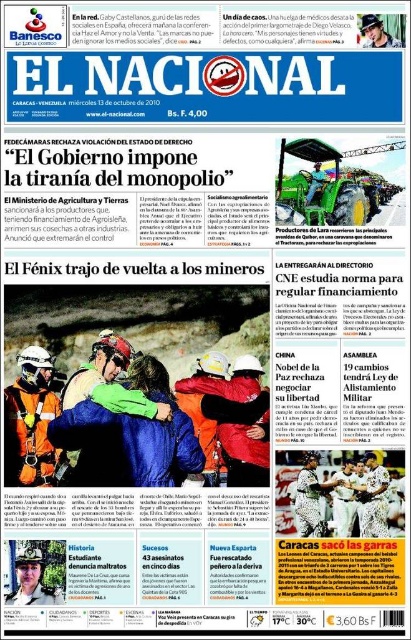
Question: Does orange reflective jacket at center come behind orange reflective safety vest at left?

Choices:
 (A) no
 (B) yes

Answer: (A)

Question: Can you confirm if camouflage fabric shirt at center is smaller than smooth leather cap at upper right?

Choices:
 (A) no
 (B) yes

Answer: (A)

Question: Is green rubber tractor at center wider than green fabric tractor at center?

Choices:
 (A) yes
 (B) no

Answer: (A)

Question: Which of the following is the closest to the observer?

Choices:
 (A) orange reflective safety vest at left
 (B) green fabric tractor at center
 (C) orange reflective jacket at center
 (D) matte black helmet at center

Answer: (D)

Question: Which object is closer to the camera taking this photo?

Choices:
 (A) matte black helmet at center
 (B) smooth leather cap at upper right

Answer: (A)

Question: Which point is farther to the camera?

Choices:
 (A) (364, 42)
 (B) (304, 202)
 (C) (23, 588)
 (D) (306, 513)

Answer: (B)